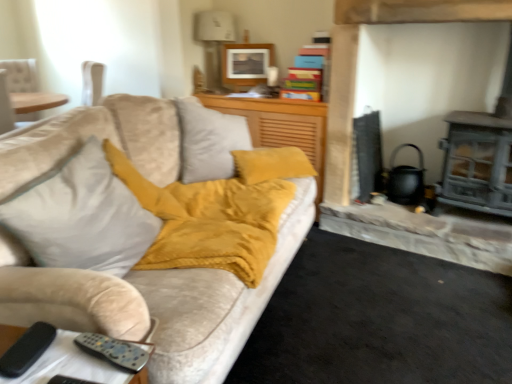
This screenshot has height=384, width=512. I want to click on free spot above metallic silver remote control at lower left (from a real-world perspective), so click(65, 361).